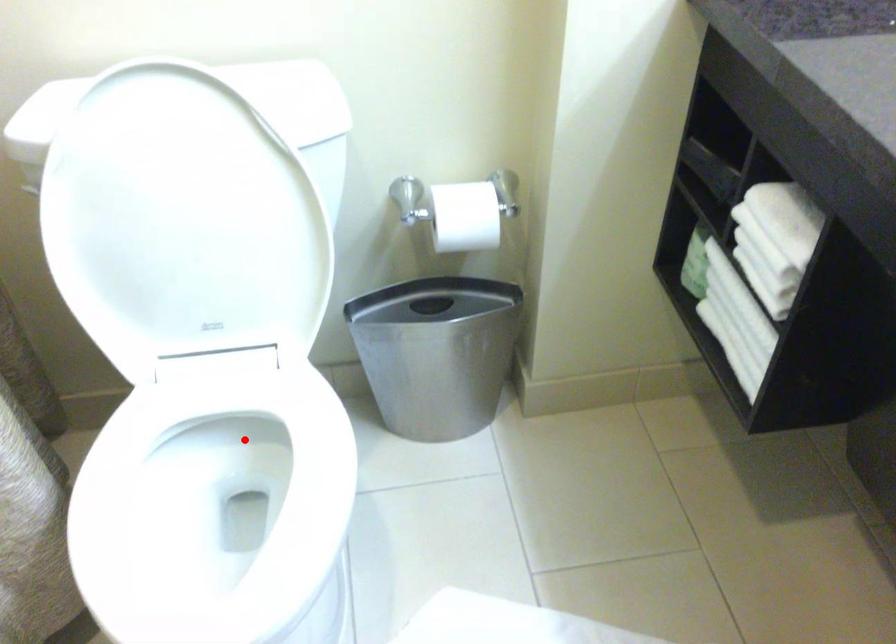
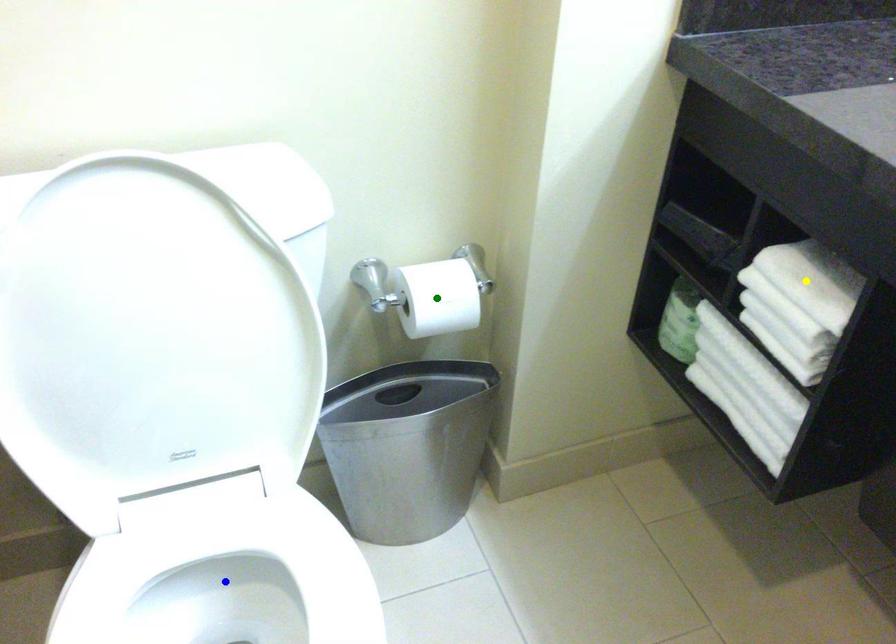
Question: I am providing you with two images of the same scene from different viewpoints. A red point is marked on the first image. You are given multiple points on the second image. Which mark in image 2 goes with the point in image 1?

Choices:
 (A) blue point
 (B) yellow point
 (C) green point

Answer: (A)